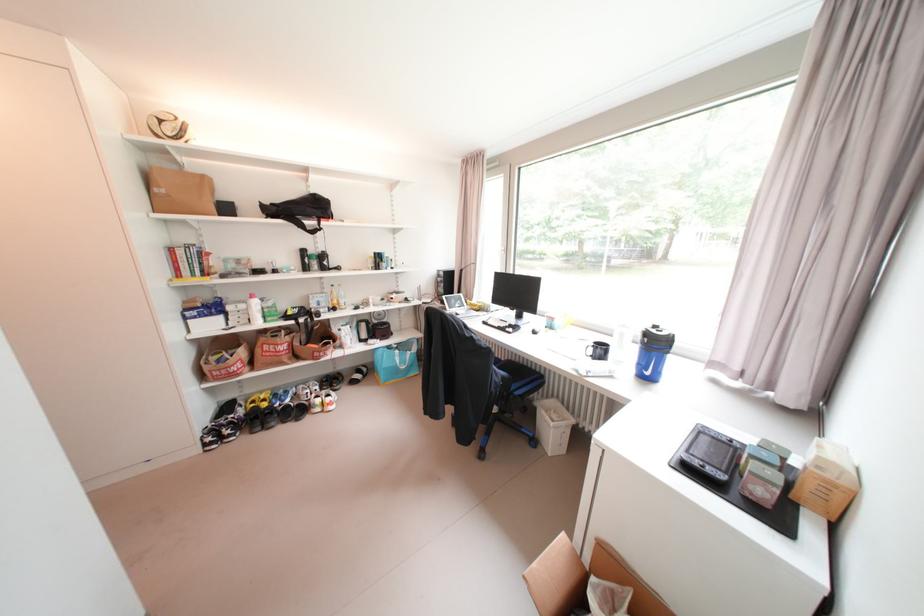
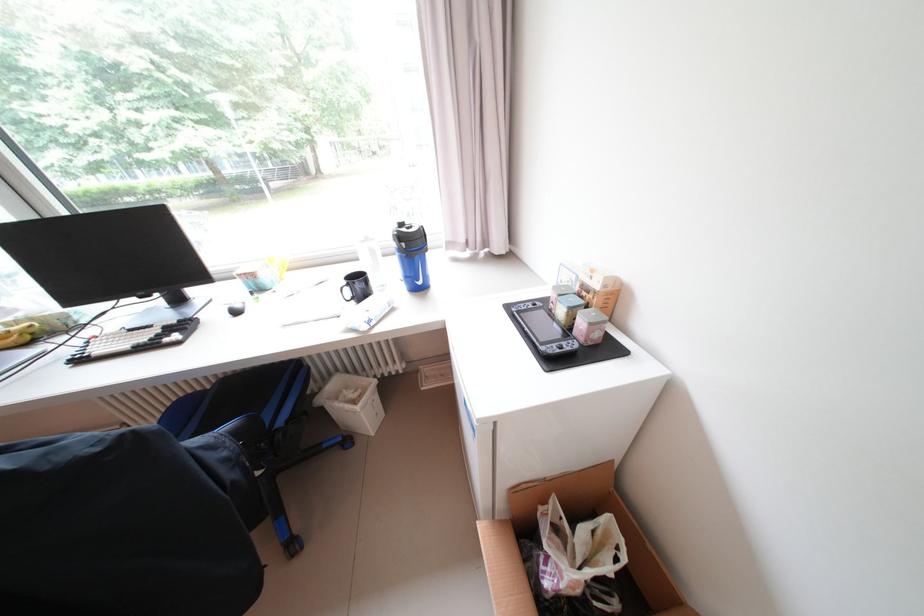
Locate, in the second image, the point that corresponds to [563,413] in the first image.

(355, 391)